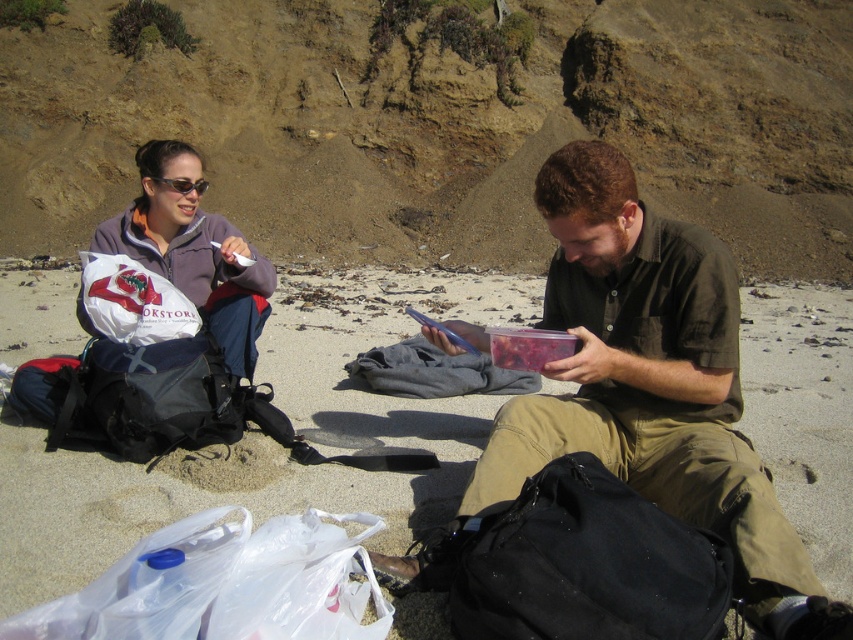
Question: Which point is closer to the camera?

Choices:
 (A) matte plastic container at center
 (B) matte purple jacket at upper left

Answer: (A)

Question: Is brown dirt hillside at upper center thinner than matte black sunglasses at upper left?

Choices:
 (A) yes
 (B) no

Answer: (B)

Question: Which object is positioned farthest from the matte purple jacket at upper left?

Choices:
 (A) matte black sunglasses at upper left
 (B) black fabric backpack at lower center

Answer: (B)

Question: Does matte plastic container at center have a lesser width compared to black fabric backpack at lower center?

Choices:
 (A) no
 (B) yes

Answer: (A)

Question: Does brown dirt hillside at upper center have a greater width compared to matte purple jacket at upper left?

Choices:
 (A) no
 (B) yes

Answer: (B)

Question: Which point is closer to the camera?

Choices:
 (A) (622, 252)
 (B) (160, 269)

Answer: (A)